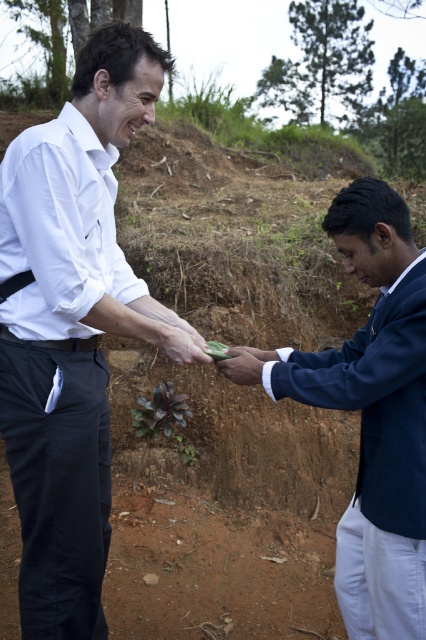
You are a fashion designer observing two items in the image. You need to determine which item is bigger between the navy blue jacket at center and the black leather belt at center. Which one is larger?

The navy blue jacket at center is larger in size than the black leather belt at center.

Looking at this image, you are standing at the point with coordinates point (65, 340) and want to walk towards the point with coordinates point (287, 369). Since you can only move forward, will the point you are walking towards appear to get larger or smaller in your field of view?

The point (287, 369) is closer to the camera than point (65, 340). Therefore, as you walk towards the point (287, 369), it will appear larger in your field of view because it is nearer to you.